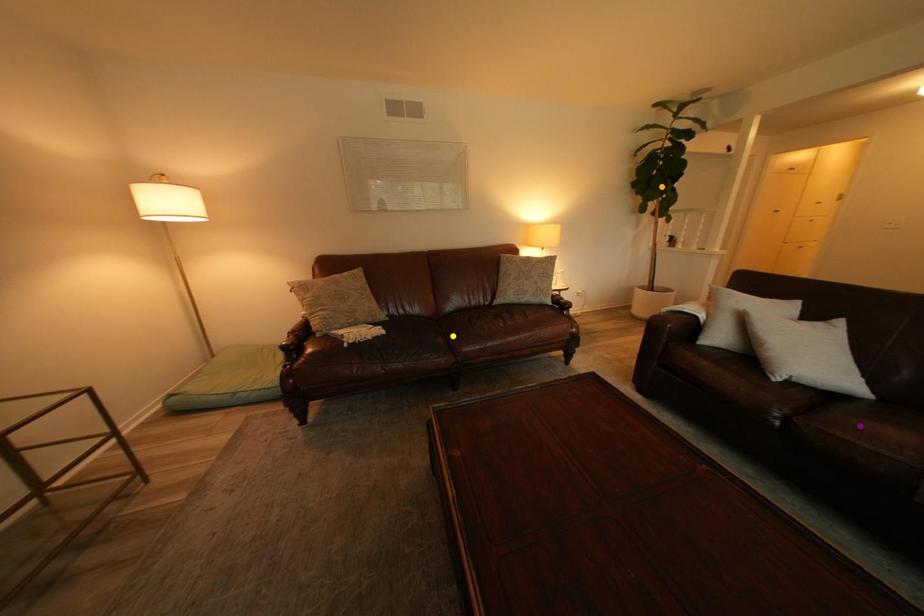
Order these from farthest to nearest:
- orange point
- purple point
- yellow point

orange point
yellow point
purple point